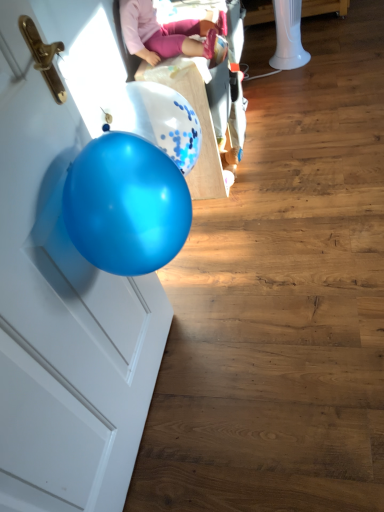
Locate an element on the screen. This screenshot has height=512, width=384. free space in front of white plastic baby carriage at upper center is located at coordinates (274, 204).